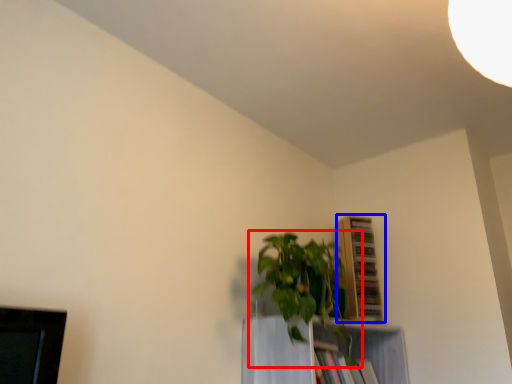
Question: Among these objects, which one is nearest to the camera, houseplant (highlighted by a red box) or shelf (highlighted by a blue box)?

Choices:
 (A) houseplant
 (B) shelf

Answer: (A)